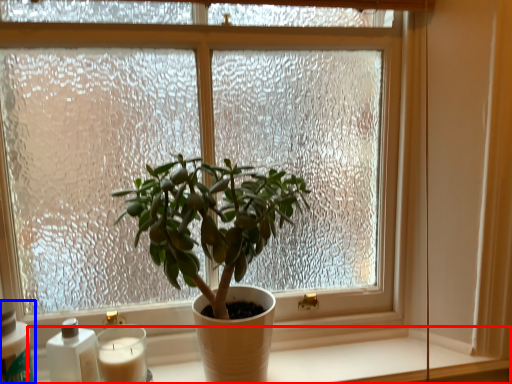
Question: Which object appears farthest to the camera in this image, window sill (highlighted by a red box) or bottle (highlighted by a blue box)?

Choices:
 (A) window sill
 (B) bottle

Answer: (A)